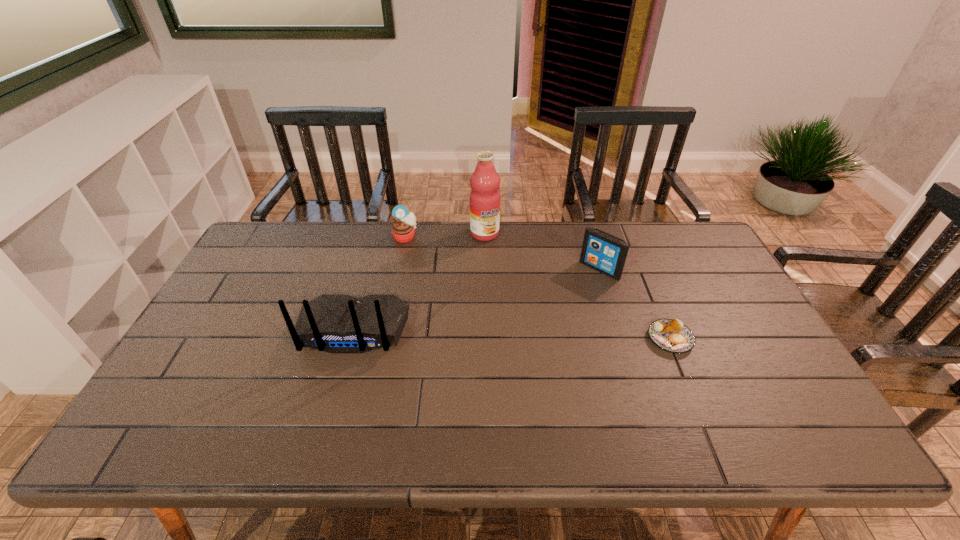
Find the location of `vacant space that's between the shortest object and the muffin`. vacant space that's between the shortest object and the muffin is located at coordinates (538, 288).

Find the location of a particular element. This screenshot has width=960, height=540. vacant space that is in between the muffin and the second object from right to left is located at coordinates (502, 253).

This screenshot has height=540, width=960. I want to click on vacant area that lies between the shortest object and the iPod, so click(x=635, y=304).

Where is `vacant area between the tallest object and the muffin`? vacant area between the tallest object and the muffin is located at coordinates (444, 235).

You are a GUI agent. You are given a task and a screenshot of the screen. Output one action in this format:
    pyautogui.click(x=<x>, y=<y>)
    Task: Click on the free space between the muffin and the third object from right to left
    
    Given the screenshot: What is the action you would take?
    pyautogui.click(x=444, y=235)

Where is `vacant area between the iPod and the rightmost object`? vacant area between the iPod and the rightmost object is located at coordinates (635, 304).

This screenshot has width=960, height=540. In order to click on free point between the muffin and the iPod in this screenshot , I will do `click(502, 253)`.

What are the coordinates of `free spot between the router and the third nearest object` in the screenshot? It's located at (476, 299).

Point out which object is positioned as the fourth nearest to the fourth object from left to right. Please provide its 2D coordinates. Your answer should be formatted as a tuple, i.e. [(x, y)], where the tuple contains the x and y coordinates of a point satisfying the conditions above.

[(403, 229)]

At what (x,y) coordinates should I click in order to perform the action: click on the second closest object to the muffin. Please return your answer as a coordinate pair (x, y). Image resolution: width=960 pixels, height=540 pixels. Looking at the image, I should click on (338, 324).